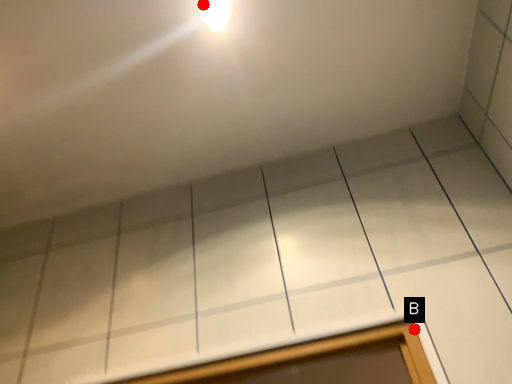
Question: Two points are circled on the image, labeled by A and B beside each circle. Among these points, which one is farthest from the camera?

Choices:
 (A) A is further
 (B) B is further

Answer: (A)